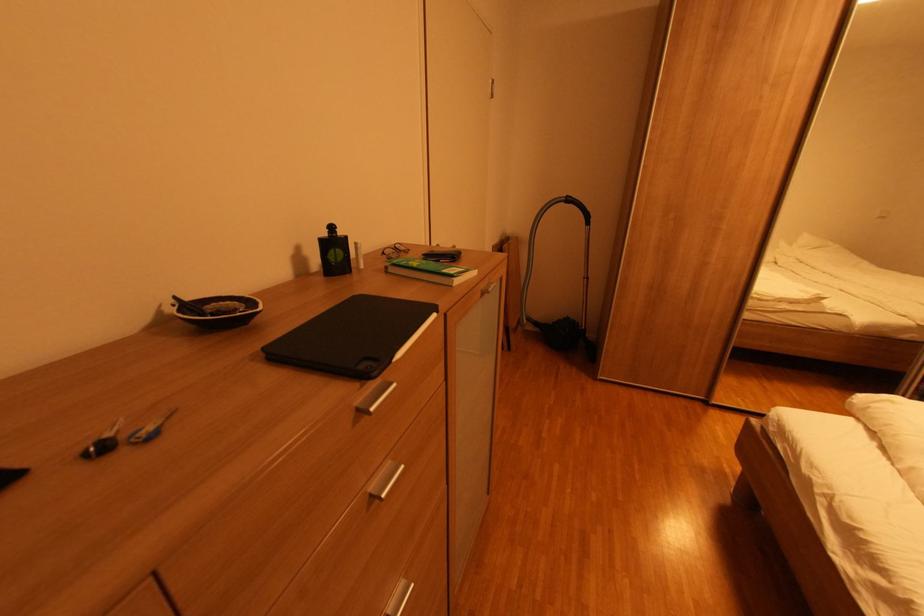
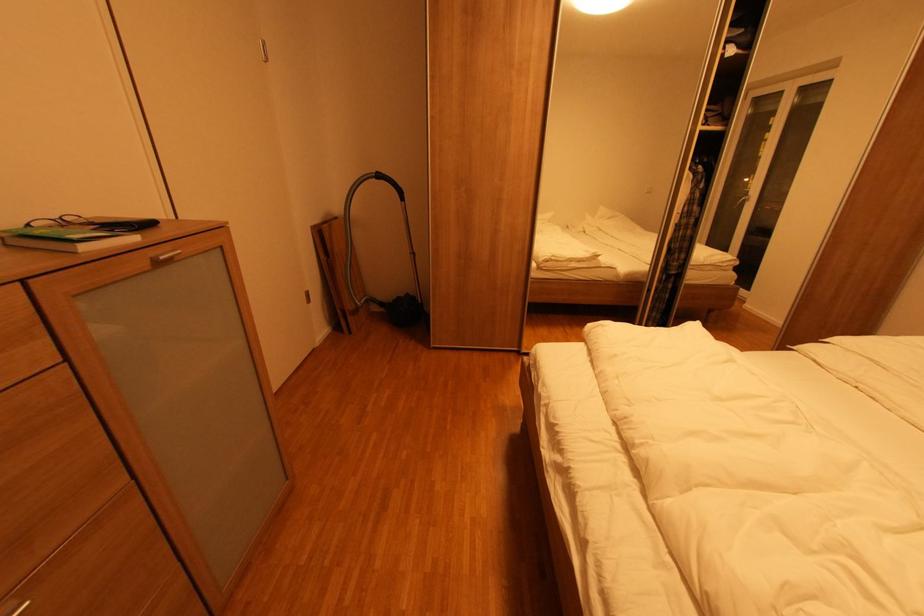
In the second image, find the point that corresponds to (489,294) in the first image.

(164, 264)